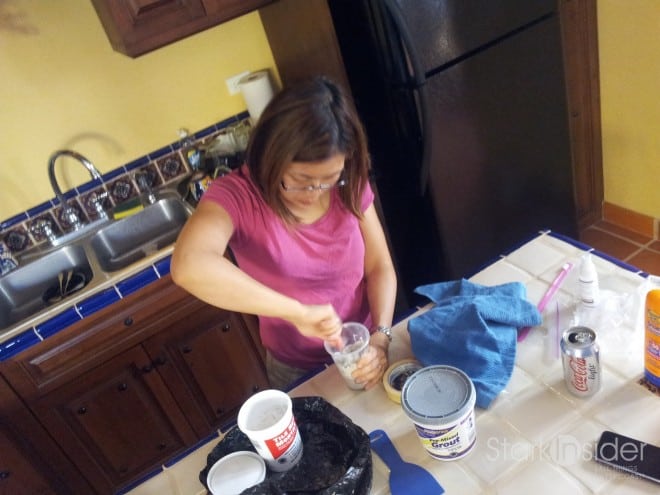
This screenshot has height=495, width=660. Find the location of `sink`. sink is located at coordinates (51, 283), (114, 261).